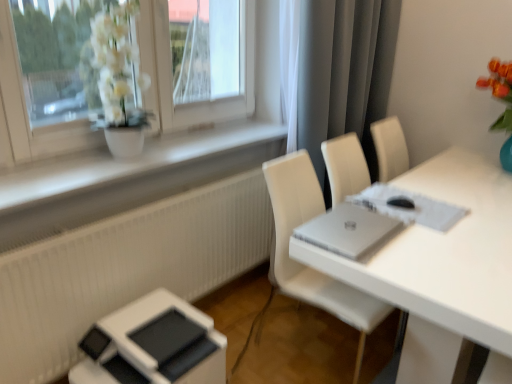
Image resolution: width=512 pixels, height=384 pixels. Find the location of `vacant space situated above silver metallic laptop at center (from a real-world perspective)`. vacant space situated above silver metallic laptop at center (from a real-world perspective) is located at coordinates tap(344, 227).